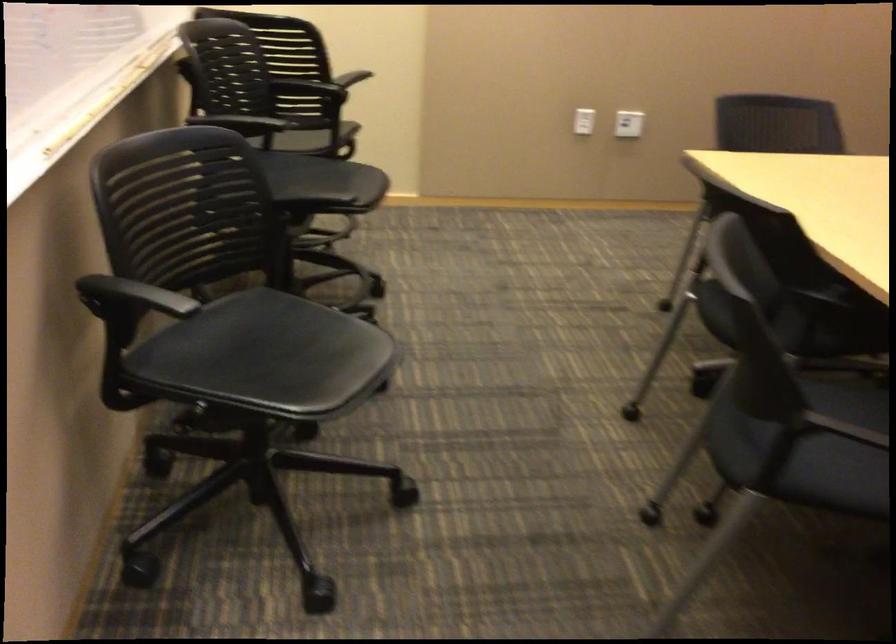
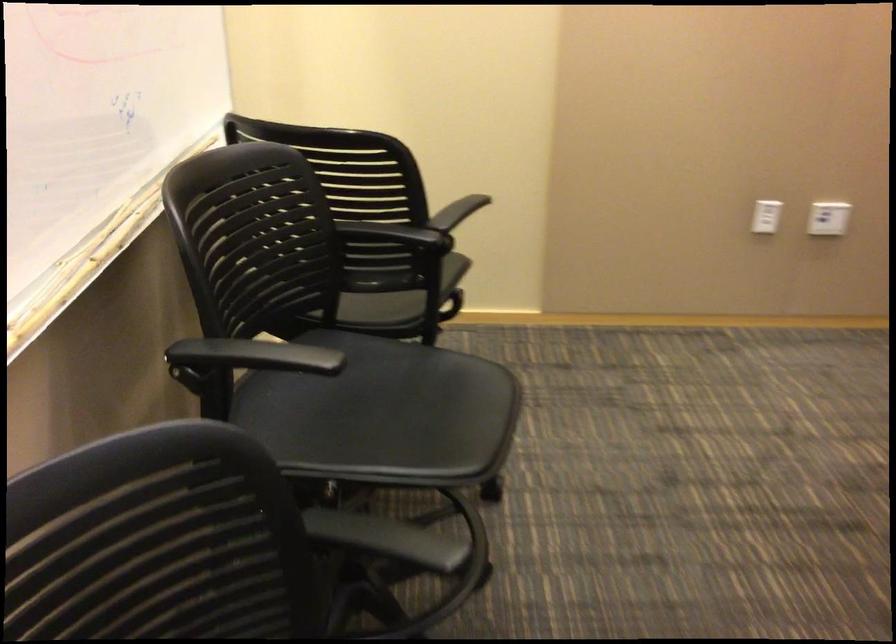
Question: In a continuous first-person perspective shot, in which direction is the camera moving?

Choices:
 (A) Left
 (B) Right
 (C) Forward
 (D) Backward

Answer: (C)